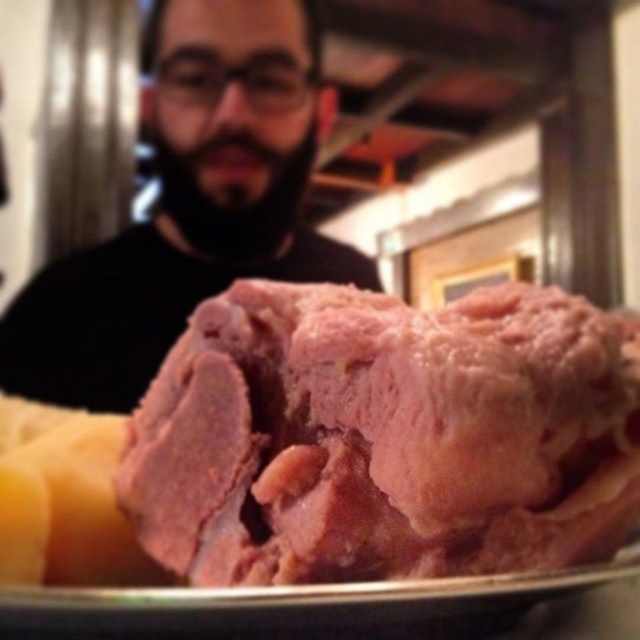
You are a chef preparing a dish and need to place the pink raw meat at center on a rectangular plate that measures 12 inches by 8 inches. Based on its position at coordinates 0.683, 0.603, will the meat fit entirely within the plate without overlapping the edges?

The pink raw meat at center is located at coordinates (x=385, y=436). Since the plate measures 12 inches by 8 inches, the coordinates are within the plate dimensions, so the meat will fit entirely without overlapping the edges.

You are a chef preparing a meal and you see the pink raw meat at center and the bearded man at upper left in the kitchen. Which object is wider?

The bearded man at upper left is wider than the pink raw meat at center.

You are a chef who needs to check the status of the pink raw meat at center. From your position in the kitchen, where should you look relative to the bearded man at upper left?

The pink raw meat at center is located below the bearded man at upper left, so you should look downward from the bearded man at upper left to find it.